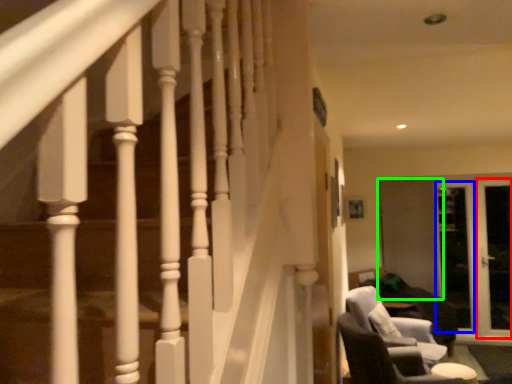
Question: Which object is positioned farthest from screen door (highlighted by a red box)? Select from screen door (highlighted by a blue box) and screen door (highlighted by a green box).

Choices:
 (A) screen door
 (B) screen door

Answer: (B)